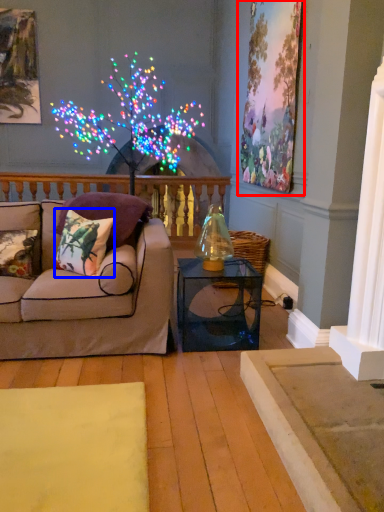
Question: Which point is closer to the camera, picture frame (highlighted by a red box) or pillow (highlighted by a blue box)?

Choices:
 (A) picture frame
 (B) pillow

Answer: (B)